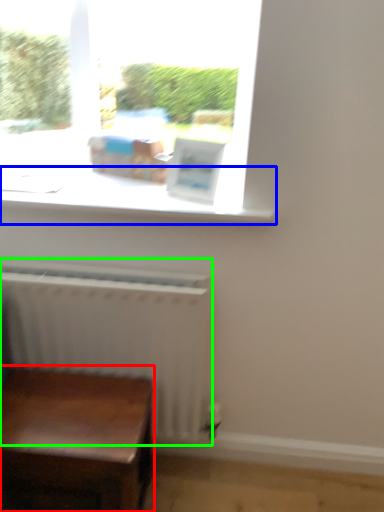
Question: Estimate the real-world distances between objects in this image. Which object is closer to table (highlighted by a red box), window sill (highlighted by a blue box) or radiator (highlighted by a green box)?

Choices:
 (A) window sill
 (B) radiator

Answer: (B)